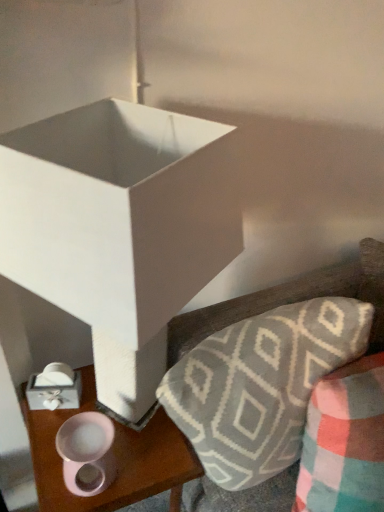
Question: Is plush gray and white geometric-patterned throw pillow at lower right wider than pink glossy mug at lower left?

Choices:
 (A) yes
 (B) no

Answer: (A)

Question: Does plush gray and white geometric-patterned throw pillow at lower right have a larger size compared to pink glossy mug at lower left?

Choices:
 (A) no
 (B) yes

Answer: (A)

Question: From the image's perspective, is plush gray and white geometric-patterned throw pillow at lower right beneath pink glossy mug at lower left?

Choices:
 (A) yes
 (B) no

Answer: (B)

Question: Could pink glossy mug at lower left be considered to be inside plush gray and white geometric-patterned throw pillow at lower right?

Choices:
 (A) yes
 (B) no

Answer: (B)

Question: From the image's perspective, is plush gray and white geometric-patterned throw pillow at lower right above pink glossy mug at lower left?

Choices:
 (A) yes
 (B) no

Answer: (A)

Question: Is plush gray and white geometric-patterned throw pillow at lower right turned away from pink glossy mug at lower left?

Choices:
 (A) yes
 (B) no

Answer: (B)

Question: Can you confirm if textured gray pillow at upper right is positioned to the right of pink glossy mug at lower left?

Choices:
 (A) no
 (B) yes

Answer: (B)

Question: Can you confirm if textured gray pillow at upper right is bigger than pink glossy mug at lower left?

Choices:
 (A) yes
 (B) no

Answer: (B)

Question: From the image's perspective, is textured gray pillow at upper right under pink glossy mug at lower left?

Choices:
 (A) yes
 (B) no

Answer: (B)

Question: Is textured gray pillow at upper right shorter than pink glossy mug at lower left?

Choices:
 (A) no
 (B) yes

Answer: (B)

Question: Is textured gray pillow at upper right positioned beyond the bounds of pink glossy mug at lower left?

Choices:
 (A) no
 (B) yes

Answer: (B)

Question: Can you see textured gray pillow at upper right touching pink glossy mug at lower left?

Choices:
 (A) no
 (B) yes

Answer: (A)

Question: Is pink matte candle holder at lower left wider than textured gray pillow at upper right?

Choices:
 (A) yes
 (B) no

Answer: (B)